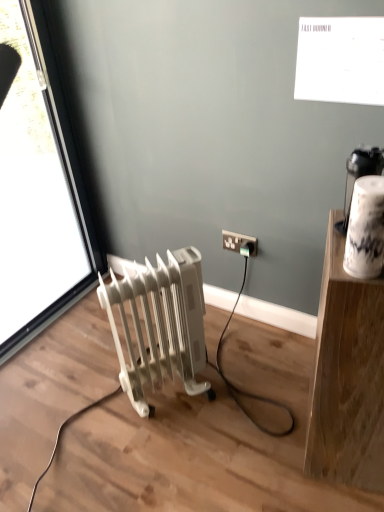
Locate an element on the screen. The height and width of the screenshot is (512, 384). vacant space that is to the left of white wood shelf at upper right is located at coordinates (261, 443).